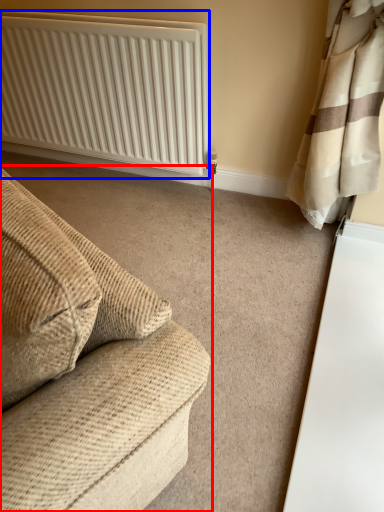
Question: Among these objects, which one is nearest to the camera, studio couch (highlighted by a red box) or radiator (highlighted by a blue box)?

Choices:
 (A) studio couch
 (B) radiator

Answer: (A)